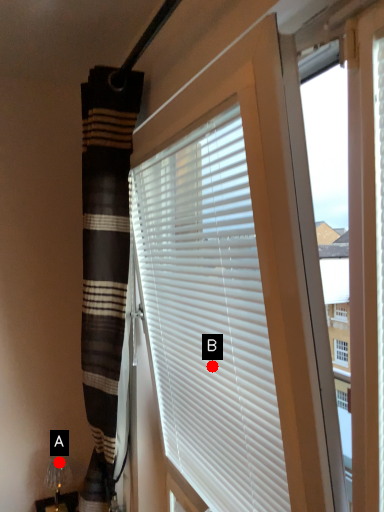
Question: Two points are circled on the image, labeled by A and B beside each circle. Which point is closer to the camera?

Choices:
 (A) A is closer
 (B) B is closer

Answer: (B)